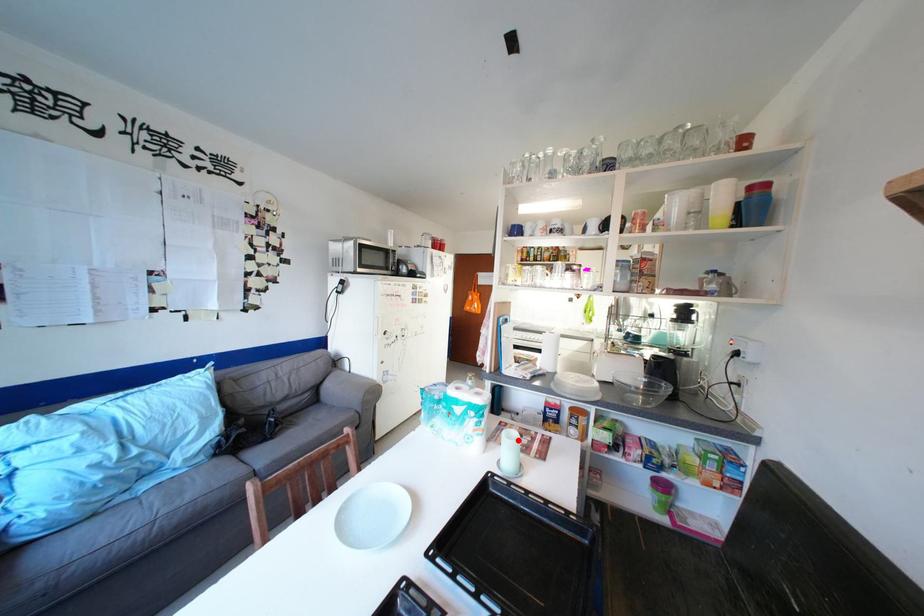
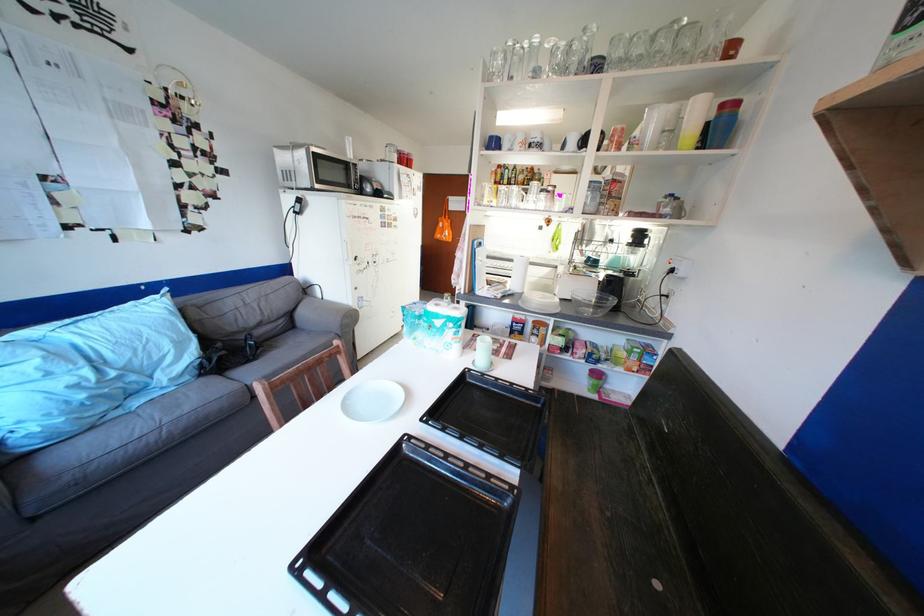
Where in the second image is the point corresponding to the highlighted location from the first image?

(492, 345)